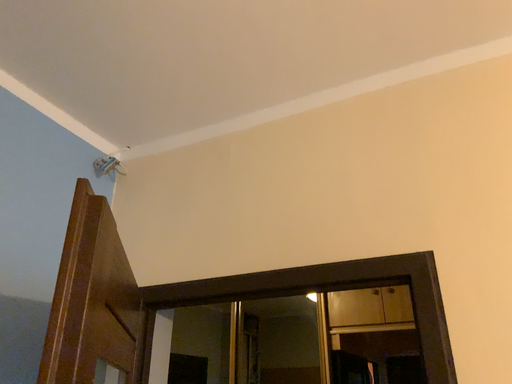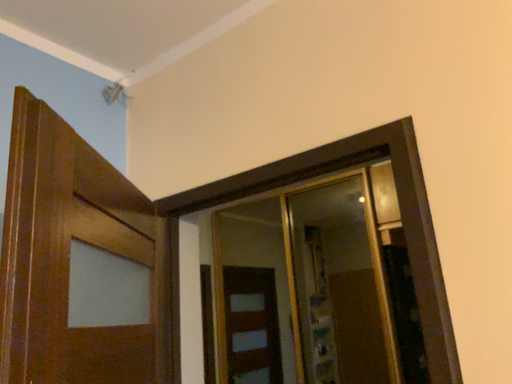
Question: How did the camera likely rotate when shooting the video?

Choices:
 (A) rotated upward
 (B) rotated downward

Answer: (B)